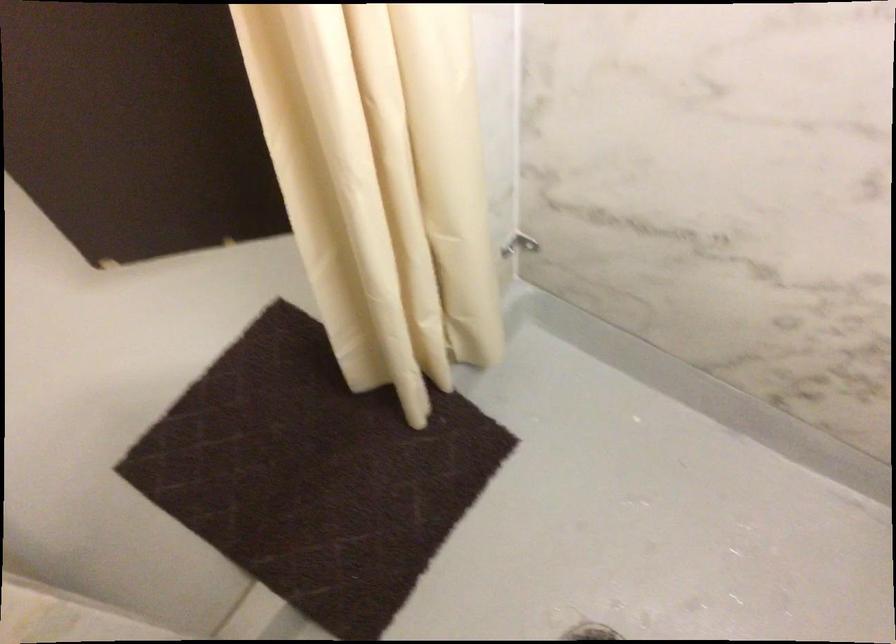
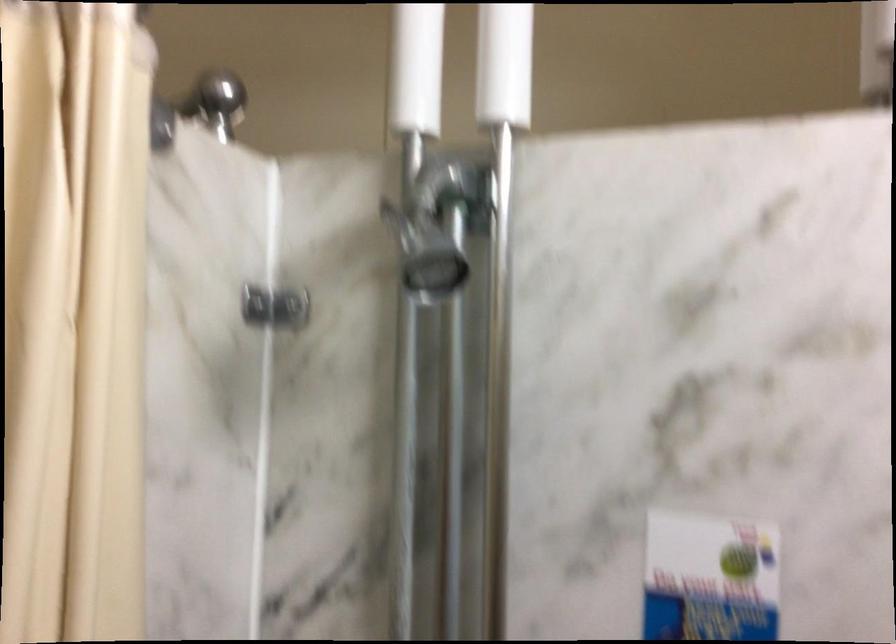
The images are taken continuously from a first-person perspective. In which direction is your viewpoint rotating?

The rotation direction of the camera is right-down.